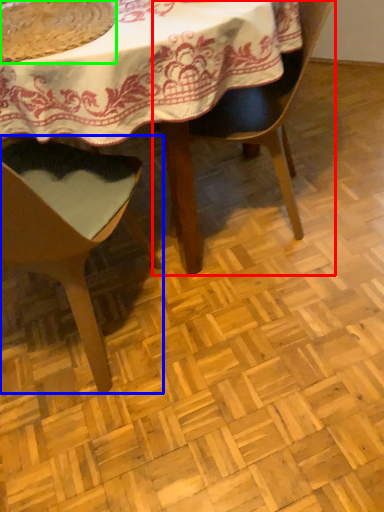
Question: Which object is the farthest from chair (highlighted by a red box)? Choose among these: chair (highlighted by a blue box) or food (highlighted by a green box).

Choices:
 (A) chair
 (B) food

Answer: (B)